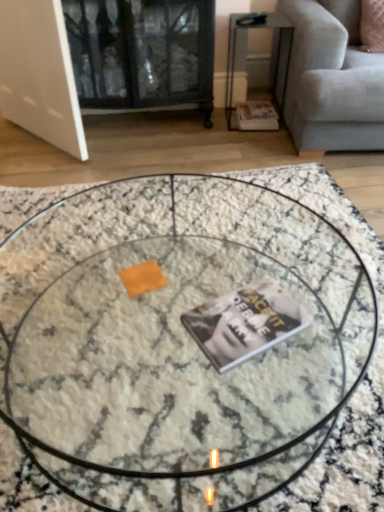
This screenshot has height=512, width=384. Identify the location of free spot to the right of hardcover book at center, arranged as the second magazine when viewed from the right. (325, 327).